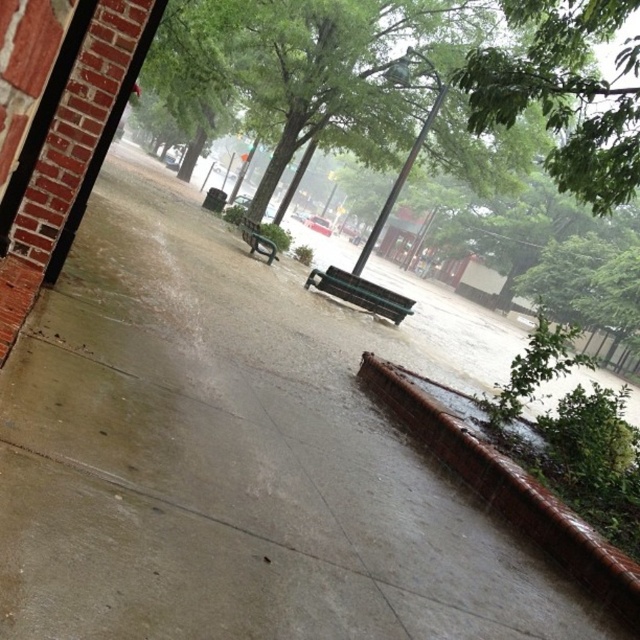
Is point (557, 77) more distant than point (257, 236)?

No.

Is point (545, 42) closer to viewer compared to point (256, 241)?

Yes, point (545, 42) is in front of point (256, 241).

Where is `green leafy tree at upper center`? green leafy tree at upper center is located at coordinates (564, 93).

Between point (397, 394) and point (340, 288), which one is positioned behind?

Point (340, 288)

Which is more to the left, brown textured curb at lower right or green matte bench at center?

Positioned to the left is green matte bench at center.

Describe the element at coordinates (506, 486) in the screenshot. I see `brown textured curb at lower right` at that location.

The height and width of the screenshot is (640, 640). Identify the location of brown textured curb at lower right. (506, 486).

Can you confirm if brown textured curb at lower right is positioned above metallic green bench at center?

No, brown textured curb at lower right is not above metallic green bench at center.

Does brown textured curb at lower right have a smaller size compared to metallic green bench at center?

Incorrect, brown textured curb at lower right is not smaller in size than metallic green bench at center.

The width and height of the screenshot is (640, 640). Identify the location of brown textured curb at lower right. (506, 486).

You are a GUI agent. You are given a task and a screenshot of the screen. Output one action in this format:
    pyautogui.click(x=<x>, y=<y>)
    Task: Click on the brown textured curb at lower right
    Image resolution: width=640 pixels, height=640 pixels.
    Given the screenshot: What is the action you would take?
    pyautogui.click(x=506, y=486)